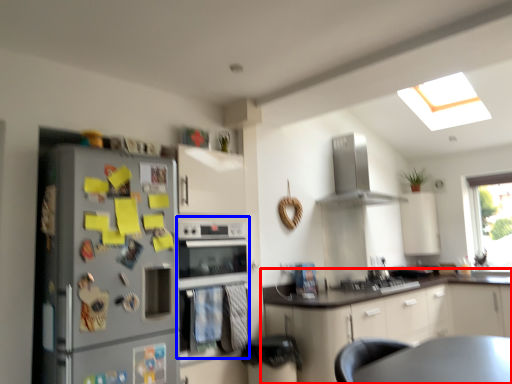
Question: Which point is further to the camera, cabinetry (highlighted by a red box) or oven (highlighted by a blue box)?

Choices:
 (A) cabinetry
 (B) oven

Answer: (A)